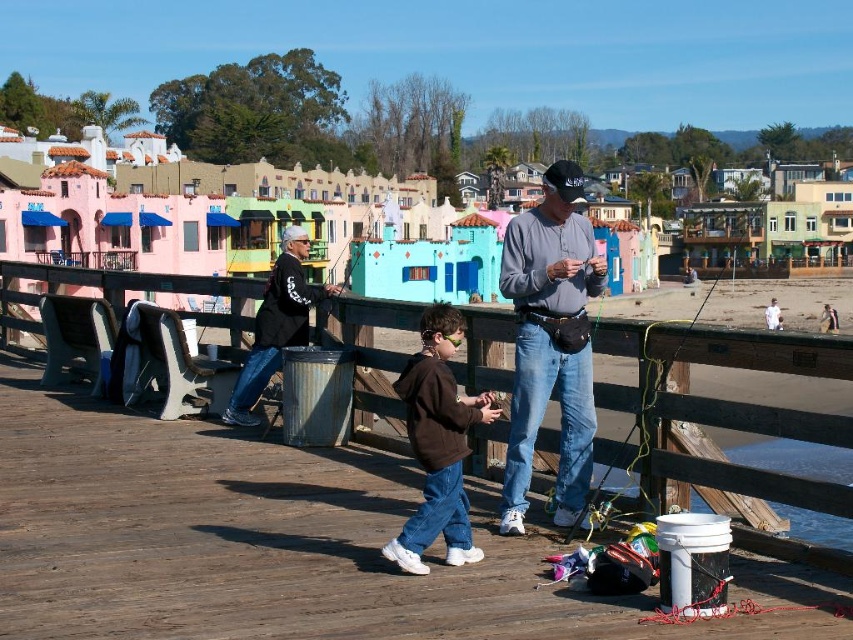
Question: Does gray cotton shirt at center appear on the right side of brown fleece jacket at center?

Choices:
 (A) yes
 (B) no

Answer: (A)

Question: Which point is farther from the camera taking this photo?

Choices:
 (A) (331, 248)
 (B) (572, 252)

Answer: (A)

Question: Is dark gray jacket at center to the right of metallic silver fishing pole at center from the viewer's perspective?

Choices:
 (A) no
 (B) yes

Answer: (A)

Question: Which point is farther to the camera?

Choices:
 (A) brown fleece jacket at center
 (B) dark gray jacket at center
 (C) green plastic fishing pole at center
 (D) metallic silver fishing pole at center

Answer: (D)

Question: Which of the following is the farthest from the observer?

Choices:
 (A) (294, 292)
 (B) (664, 504)

Answer: (A)

Question: From the image, what is the correct spatial relationship of gray cotton shirt at center in relation to brown fleece jacket at center?

Choices:
 (A) left
 (B) right

Answer: (B)